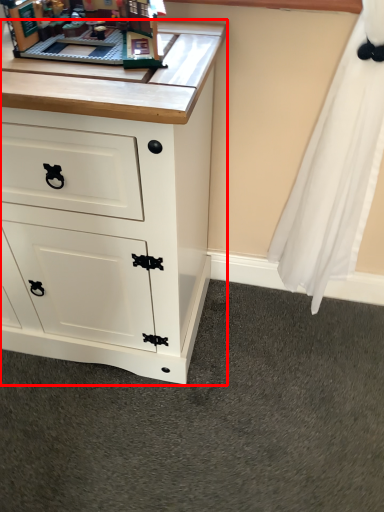
Question: From the image's perspective, considering the relative positions of chest of drawers (annotated by the red box) and toy in the image provided, where is chest of drawers (annotated by the red box) located with respect to the staircase?

Choices:
 (A) above
 (B) below

Answer: (B)